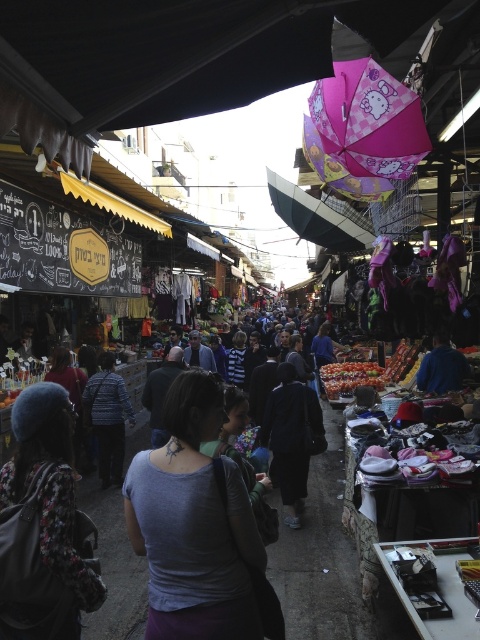
Question: Can you confirm if purple matte shirt at center is positioned above floral fabric jacket at lower left?

Choices:
 (A) yes
 (B) no

Answer: (A)

Question: Is dark blue fabric jacket at center positioned in front of striped shirt at center?

Choices:
 (A) yes
 (B) no

Answer: (A)

Question: Which is nearer to the dark blue fabric jacket at center?

Choices:
 (A) purple matte shirt at center
 (B) floral fabric jacket at lower left

Answer: (A)

Question: Which object is farther from the camera taking this photo?

Choices:
 (A) purple matte shirt at center
 (B) dark blue fabric jacket at center
 (C) floral fabric jacket at lower left

Answer: (B)

Question: Is pink matte umbrella at upper center closer to camera compared to striped shirt at center?

Choices:
 (A) yes
 (B) no

Answer: (A)

Question: Estimate the real-world distances between objects in this image. Which object is farther from the pink matte umbrella at upper center?

Choices:
 (A) purple matte shirt at center
 (B) floral fabric jacket at lower left
 (C) striped shirt at center
 (D) dark blue fabric jacket at center

Answer: (C)